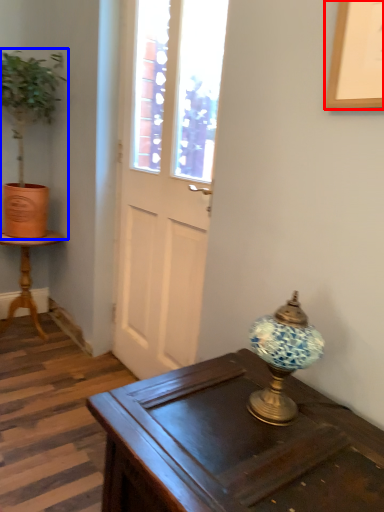
Question: Which of the following is the closest to the observer, picture frame (highlighted by a red box) or houseplant (highlighted by a blue box)?

Choices:
 (A) picture frame
 (B) houseplant

Answer: (A)